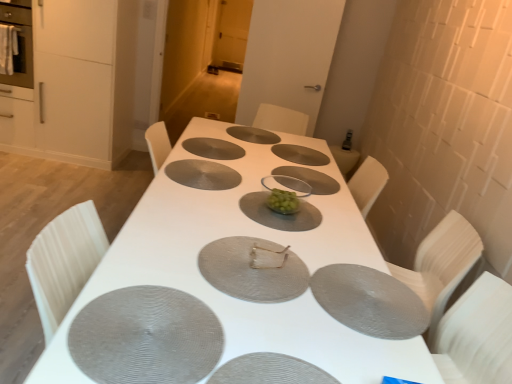
Locate an element on the screen. vacant space in between metallic silver pizza pan at center, positioned as the 5th pizza pan in back-to-front order, and green matte platter at center is located at coordinates (268, 230).